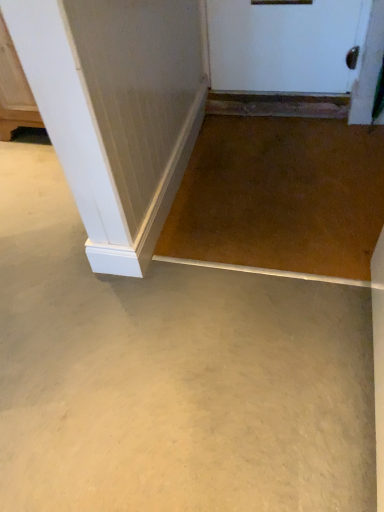
At what (x,y) coordinates should I click in order to perform the action: click on vacant space positioned to the left of clear glass screen door at upper right. Please return your answer as a coordinate pair (x, y). Looking at the image, I should click on (339, 139).